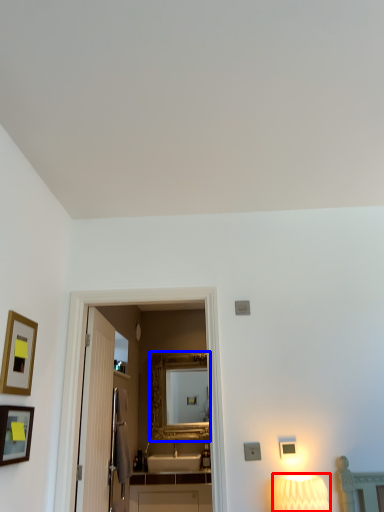
Question: Which object appears closest to the camera in this image, lamp (highlighted by a red box) or mirror (highlighted by a blue box)?

Choices:
 (A) lamp
 (B) mirror

Answer: (A)